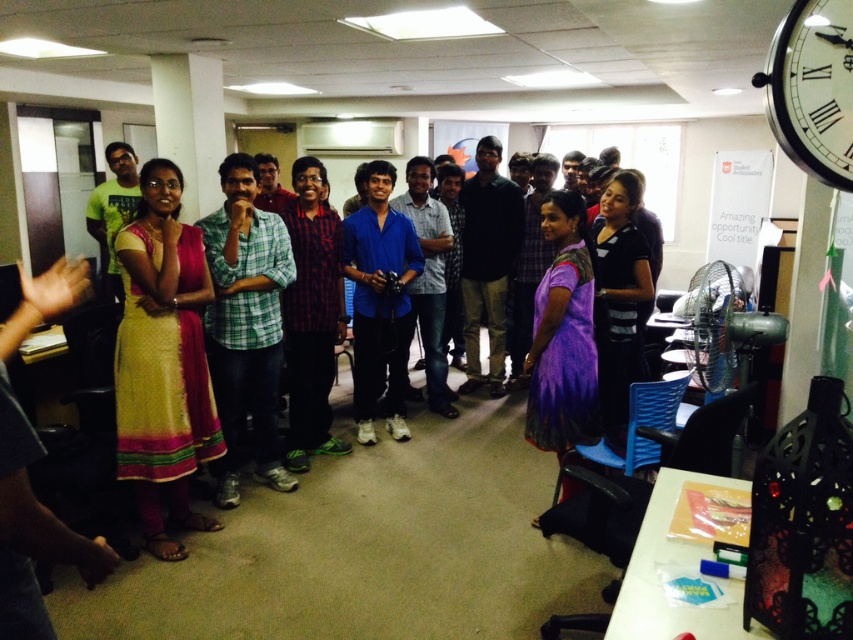
Based on the coordinates provided, which object is located at point (245, 324) in the image?

The point (245, 324) corresponds to the green plaid shirt at center.

You are organizing a photo shoot and need to ensure that all participants are visible in the frame. Given that the yellow cotton dress at left and the green plaid shirt at center are part of the group, which clothing item takes up less space horizontally in the image?

The yellow cotton dress at left takes up less horizontal space in the image because it has a lesser width compared to the green plaid shirt at center.

You are standing at the entrance of the room and want to find the green plaid shirt at center. According to the coordinates given, where should you look relative to the room?

The green plaid shirt at center is located at coordinates point [245,324], which is in the center of the room.